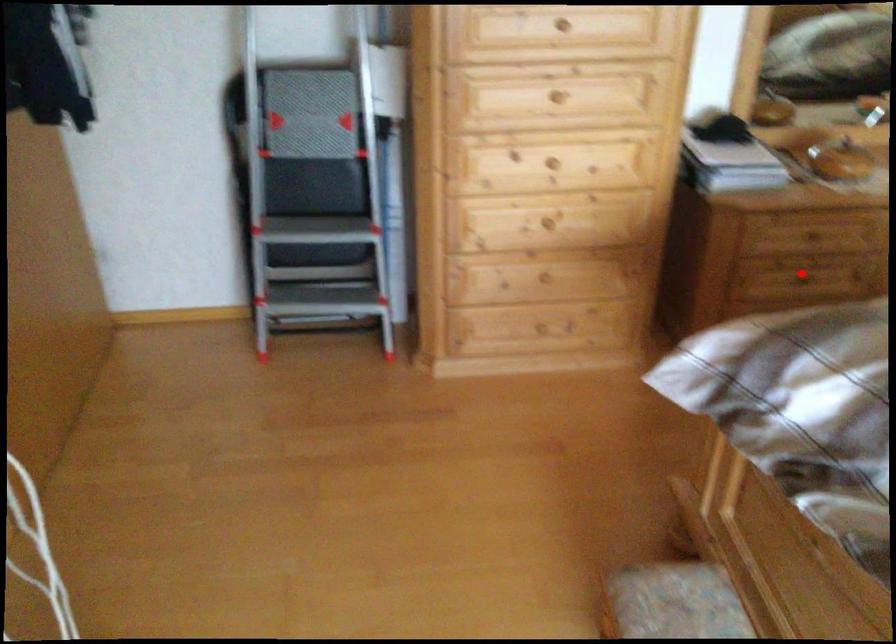
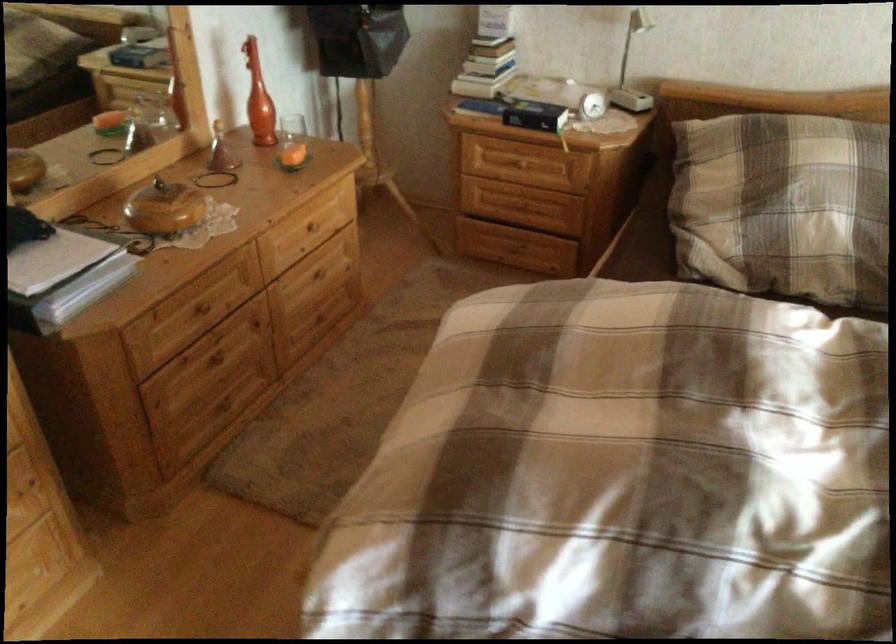
Find the pixel in the second image that matches the highlighted location in the first image.

(218, 362)